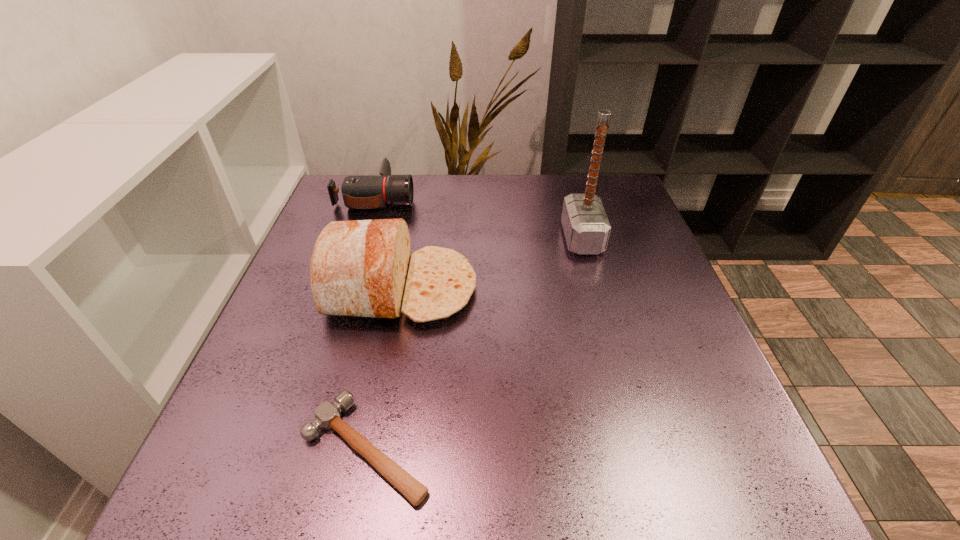
This screenshot has height=540, width=960. In order to click on vacant space situated 0.330m at the sliced end of the bread in this screenshot , I will do `click(627, 288)`.

This screenshot has height=540, width=960. I want to click on free region located on the lens of the second shortest object, so click(x=553, y=198).

Where is `vacant space located on the back of the left hammer`? vacant space located on the back of the left hammer is located at coordinates (396, 303).

I want to click on object located at the far edge, so click(x=359, y=192).

The width and height of the screenshot is (960, 540). Identify the location of object that is at the near edge. (327, 415).

Where is `bread at the left edge`? The width and height of the screenshot is (960, 540). bread at the left edge is located at coordinates (362, 268).

This screenshot has height=540, width=960. Find the location of `camcorder at the left edge`. camcorder at the left edge is located at coordinates (359, 192).

Locate an element on the screen. The width and height of the screenshot is (960, 540). hammer at the left edge is located at coordinates (327, 415).

Find the location of a particular element. This screenshot has height=540, width=960. object that is at the right edge is located at coordinates (586, 227).

This screenshot has width=960, height=540. Find the location of `object that is positioned at the far left corner`. object that is positioned at the far left corner is located at coordinates (359, 192).